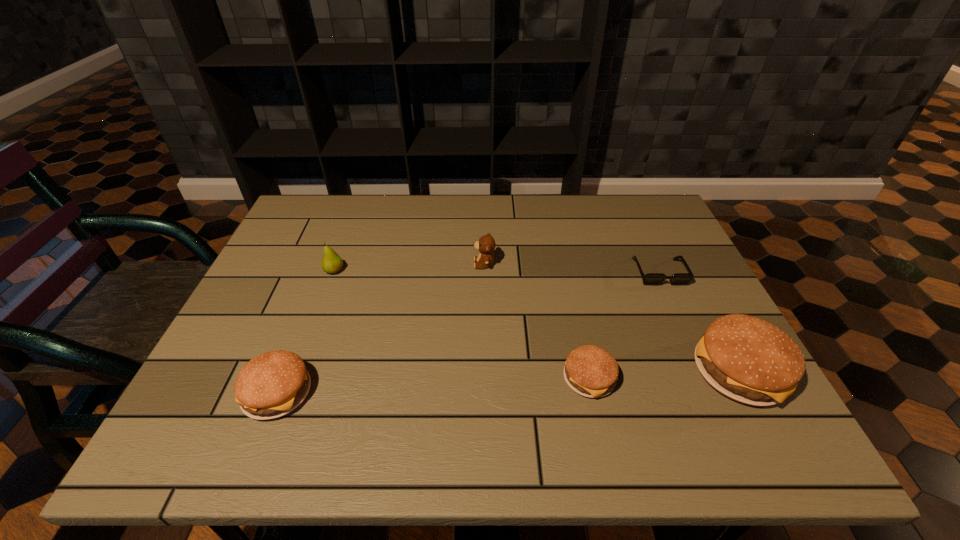
Where is `the second shortest hamburger`? This screenshot has height=540, width=960. the second shortest hamburger is located at coordinates (272, 384).

You are a GUI agent. You are given a task and a screenshot of the screen. Output one action in this format:
    pyautogui.click(x=<x>, y=<y>)
    Task: Click on the fifth tallest object
    
    Given the screenshot: What is the action you would take?
    pyautogui.click(x=591, y=371)

I want to click on the third object from right to left, so click(591, 371).

Find the location of `the rightmost hamburger`. the rightmost hamburger is located at coordinates (x=747, y=359).

Find the location of a particular element. pear is located at coordinates (331, 263).

At what (x,y) coordinates should I click in order to perform the action: click on sunglasses. Please return your answer as a coordinate pair (x, y). The height and width of the screenshot is (540, 960). Looking at the image, I should click on (651, 278).

In order to click on the third object from left to right in this screenshot , I will do `click(486, 244)`.

The height and width of the screenshot is (540, 960). Find the location of `free spot located 0.070m on the right of the second shortest hamburger`. free spot located 0.070m on the right of the second shortest hamburger is located at coordinates (346, 393).

Identify the location of vacant space located 0.230m on the back of the shortest hamburger. The height and width of the screenshot is (540, 960). (569, 286).

This screenshot has height=540, width=960. I want to click on vacant space situated on the left of the rightmost hamburger, so click(x=613, y=372).